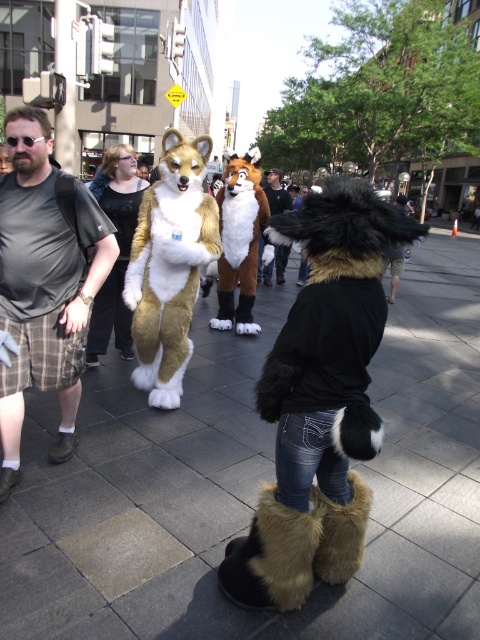
Does point (250, 161) come in front of point (277, 189)?

Yes, it is.

Who is more forward, (x=242, y=307) or (x=288, y=209)?

Positioned in front is point (x=242, y=307).

Find the location of `brown plush fox at center`. brown plush fox at center is located at coordinates (240, 241).

Between gray concrete pavement at center and brown fur coat at center, which one has less height?

gray concrete pavement at center

Is gray concrete pavement at center smaller than brown fur coat at center?

Incorrect, gray concrete pavement at center is not smaller in size than brown fur coat at center.

Is point (180, 596) behind point (269, 196)?

That is False.

Where is `gray concrete pavement at center`? The height and width of the screenshot is (640, 480). gray concrete pavement at center is located at coordinates (255, 484).

From the picture: Does matte black shirt at center have a larger size compared to brown fur coat at center?

No.

From the picture: Who is positioned more to the left, matte black shirt at center or brown fur coat at center?

matte black shirt at center is more to the left.

Between point (99, 243) and point (268, 198), which one is positioned behind?

The point (268, 198) is more distant.

Locate an element on the screen. matte black shirt at center is located at coordinates (45, 282).